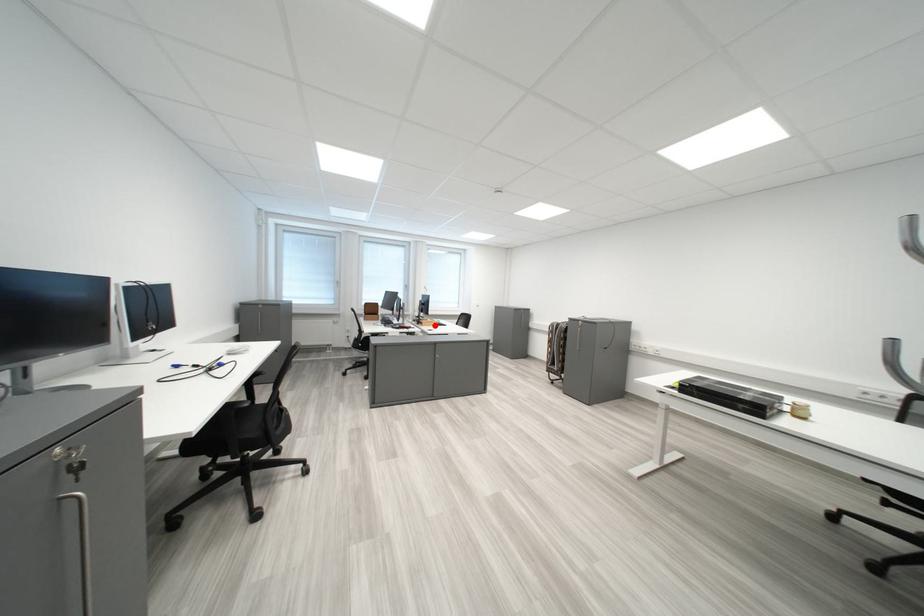
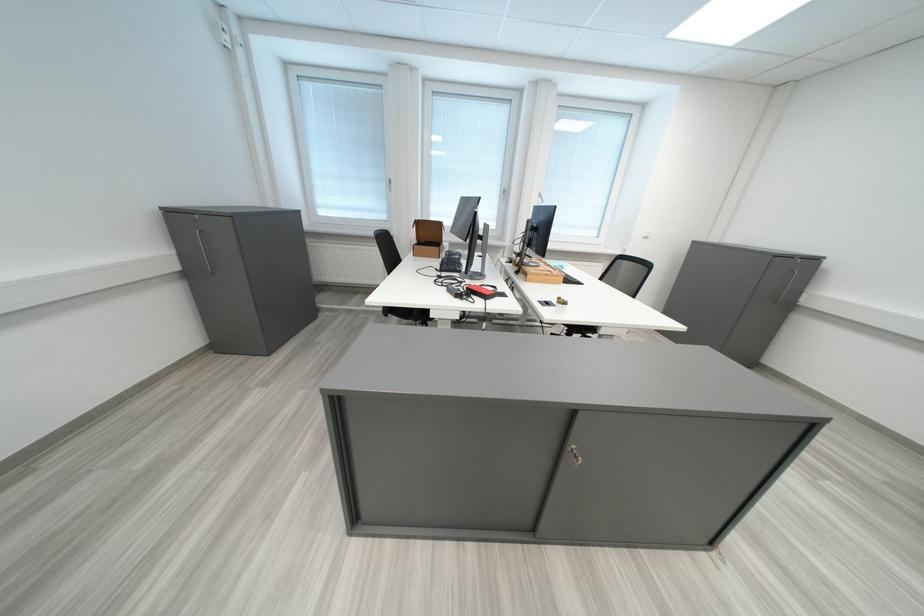
Find the pixel in the second image that matches the highlighted location in the first image.

(539, 276)